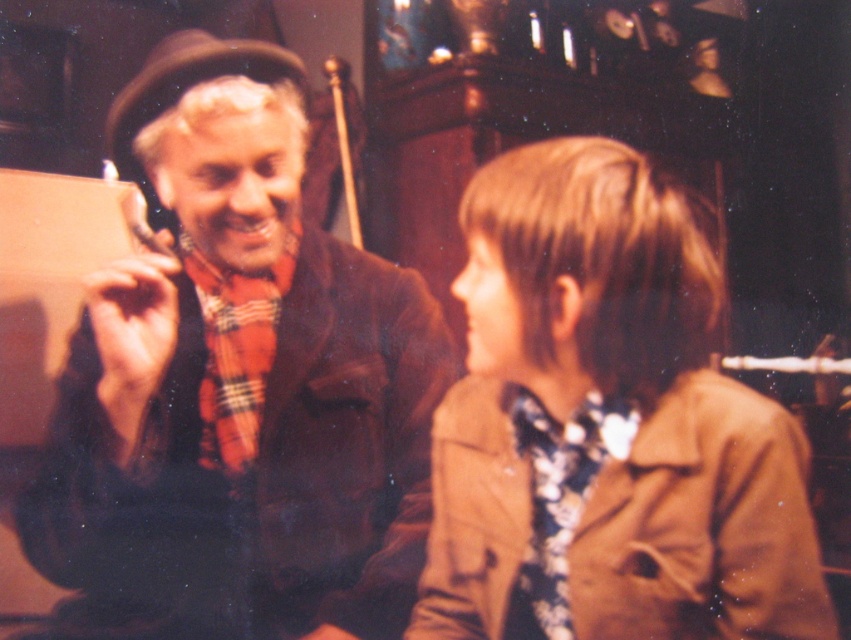
The width and height of the screenshot is (851, 640). What do you see at coordinates (238, 378) in the screenshot?
I see `brown woolen sweater at left` at bounding box center [238, 378].

Between point (284, 150) and point (558, 458), which one is positioned behind?

Positioned behind is point (284, 150).

Where is `brown woolen sweater at left`? The width and height of the screenshot is (851, 640). brown woolen sweater at left is located at coordinates (238, 378).

What are the coordinates of `brown woolen sweater at left` in the screenshot? It's located at (238, 378).

Can you confirm if brown leather trench coat at lower right is smaller than floral fabric tie at lower right?

Actually, brown leather trench coat at lower right might be larger than floral fabric tie at lower right.

Is point (644, 534) closer to viewer compared to point (575, 504)?

Yes.

Where is `brown leather trench coat at lower right`? The height and width of the screenshot is (640, 851). brown leather trench coat at lower right is located at coordinates (701, 525).

Find the location of a particular element. brown woolen sweater at left is located at coordinates pos(238,378).